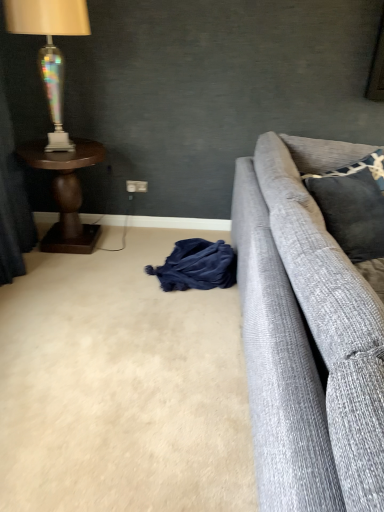
Question: Does iridescent glass lamp at left have a lesser height compared to dark gray textured pillow at right, marked as the 2th pillow in a top-to-bottom arrangement?

Choices:
 (A) no
 (B) yes

Answer: (B)

Question: Considering the relative sizes of iridescent glass lamp at left and dark gray textured pillow at right, acting as the 1th pillow starting from the bottom, in the image provided, is iridescent glass lamp at left taller than dark gray textured pillow at right, acting as the 1th pillow starting from the bottom,?

Choices:
 (A) yes
 (B) no

Answer: (B)

Question: From a real-world perspective, is iridescent glass lamp at left physically below dark gray textured pillow at right, acting as the 1th pillow starting from the bottom?

Choices:
 (A) yes
 (B) no

Answer: (B)

Question: Is iridescent glass lamp at left aimed at dark gray textured pillow at right, marked as the 2th pillow in a top-to-bottom arrangement?

Choices:
 (A) no
 (B) yes

Answer: (A)

Question: Is iridescent glass lamp at left smaller than dark gray textured pillow at right, acting as the 1th pillow starting from the bottom?

Choices:
 (A) no
 (B) yes

Answer: (B)

Question: From a real-world perspective, is beige carpet at lower left above or below velvet dark blue curtain at left?

Choices:
 (A) above
 (B) below

Answer: (B)

Question: In the image, is beige carpet at lower left positioned in front of or behind velvet dark blue curtain at left?

Choices:
 (A) behind
 (B) front

Answer: (A)

Question: Is point (142, 285) closer or farther from the camera than point (0, 74)?

Choices:
 (A) closer
 (B) farther

Answer: (B)

Question: From their relative heights in the image, would you say beige carpet at lower left is taller or shorter than velvet dark blue curtain at left?

Choices:
 (A) short
 (B) tall

Answer: (A)

Question: Is dark blue fabric at lower center wider or thinner than iridescent glass lamp at left?

Choices:
 (A) wide
 (B) thin

Answer: (A)

Question: Is dark blue fabric at lower center taller or shorter than iridescent glass lamp at left?

Choices:
 (A) tall
 (B) short

Answer: (B)

Question: From a real-world perspective, is dark blue fabric at lower center physically located above or below iridescent glass lamp at left?

Choices:
 (A) above
 (B) below

Answer: (B)

Question: From the image's perspective, is dark blue fabric at lower center above or below iridescent glass lamp at left?

Choices:
 (A) above
 (B) below

Answer: (B)

Question: From the image's perspective, is velvet dark blue curtain at left positioned above or below dark blue fabric at lower center?

Choices:
 (A) above
 (B) below

Answer: (A)

Question: Considering the positions of velvet dark blue curtain at left and dark blue fabric at lower center in the image, is velvet dark blue curtain at left wider or thinner than dark blue fabric at lower center?

Choices:
 (A) thin
 (B) wide

Answer: (A)